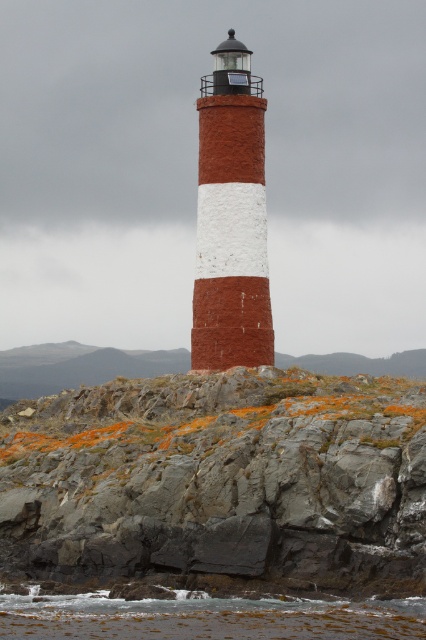
Between gray rock at center and clear water at lower center, which one is positioned higher?

gray rock at center is higher up.

Does gray rock at center have a greater height compared to clear water at lower center?

Indeed, gray rock at center has a greater height compared to clear water at lower center.

What are the coordinates of `gray rock at center` in the screenshot? It's located at (219, 483).

Looking at this image, is gray rock at center wider than brick red lighthouse at center?

Yes, gray rock at center is wider than brick red lighthouse at center.

Who is taller, gray rock at center or brick red lighthouse at center?

With more height is brick red lighthouse at center.

Who is more distant from viewer, (403, 433) or (193, 333)?

Point (193, 333)

The height and width of the screenshot is (640, 426). Identify the location of gray rock at center. (219, 483).

Can you confirm if brick red lighthouse at center is wider than clear water at lower center?

Incorrect, brick red lighthouse at center's width does not surpass clear water at lower center's.

Between brick red lighthouse at center and clear water at lower center, which one is positioned higher?

brick red lighthouse at center

Who is more forward, (245, 84) or (135, 637)?

Point (135, 637) is more forward.

At what (x,y) coordinates should I click in order to perform the action: click on brick red lighthouse at center. Please return your answer as a coordinate pair (x, y). This screenshot has width=426, height=640. Looking at the image, I should click on (230, 220).